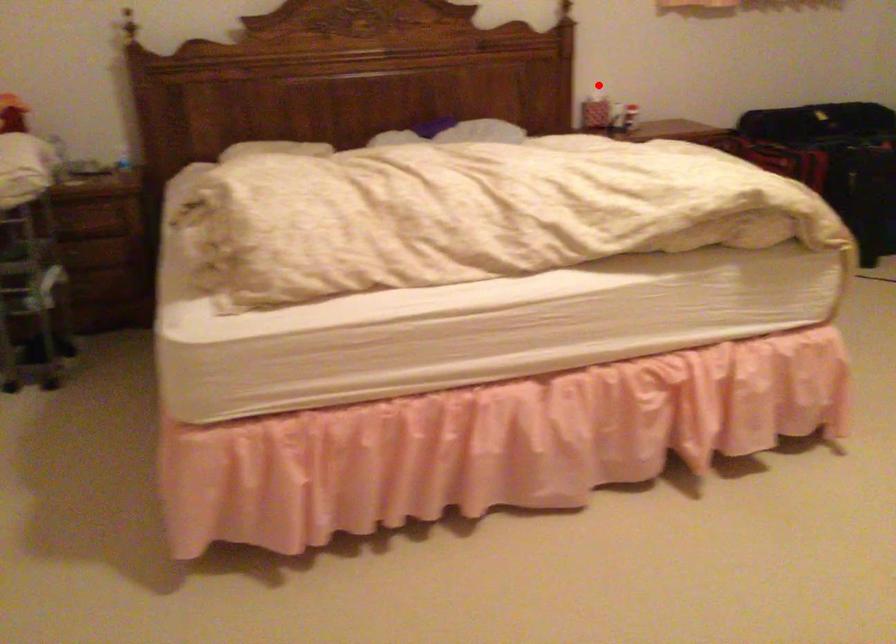
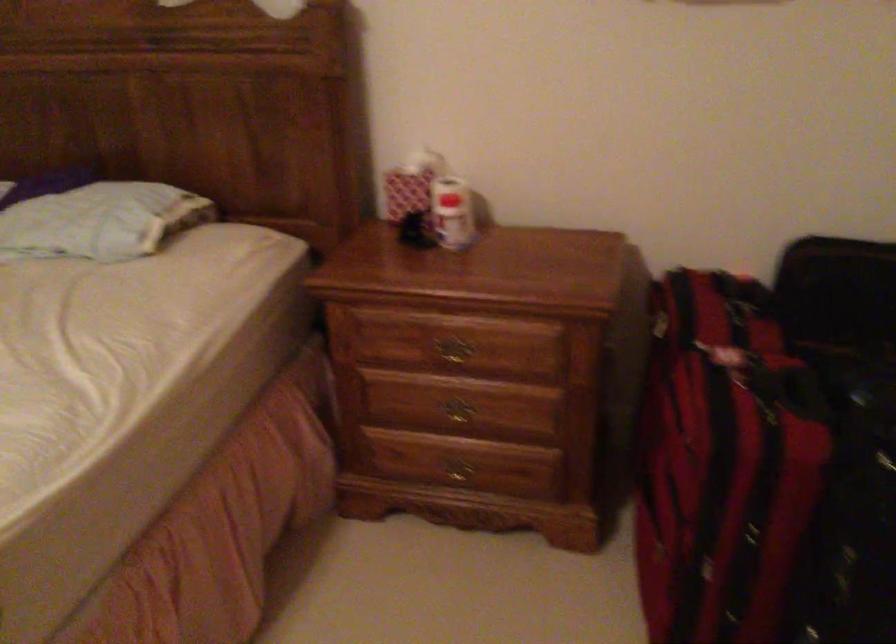
Locate, in the second image, the point that corresponds to the highlighted location in the first image.

(410, 184)